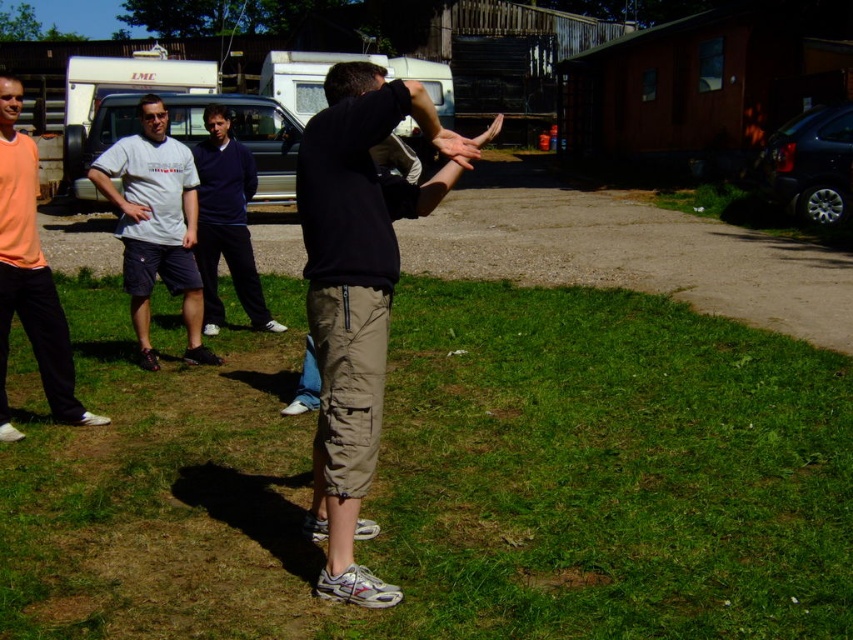
You are standing at the point labeled as point (245, 163) and want to move towards the point labeled as point (114, 160). Given that you can only move in a straight line, will you be moving towards or away from the white camper van parked near the red building with a green roof?

You will be moving towards the white camper van parked near the red building with a green roof because point (114, 160) is closer to the viewer than point (245, 163), meaning the direction from point (245, 163) to point (114, 160) is towards the viewer, which aligns with the direction of the white camper van.

Based on the scene description, where is the orange cotton shirt at left located in terms of its 2D coordinates?

The orange cotton shirt at left is located at the 2D coordinates point [28,275].